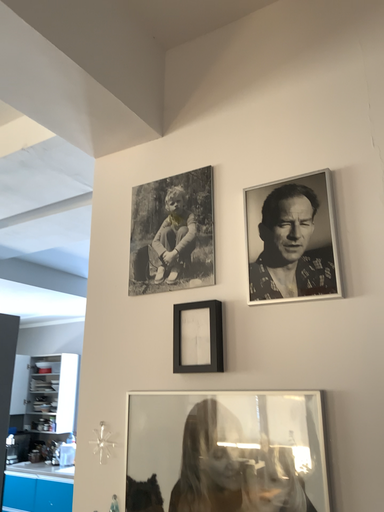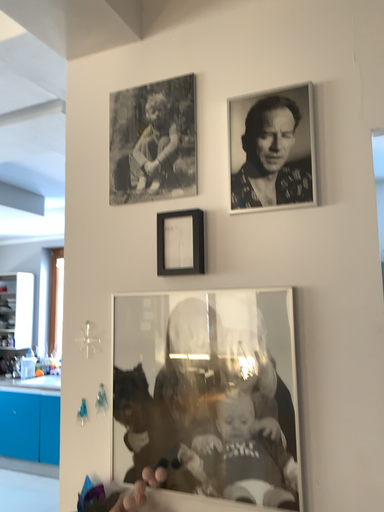
Question: Which way did the camera rotate in the video?

Choices:
 (A) rotated upward
 (B) rotated downward

Answer: (B)